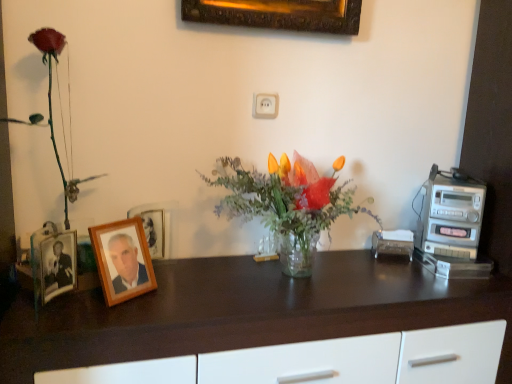
Locate an element on the screen. Image resolution: width=512 pixels, height=384 pixels. free location to the right of wooden picture frame at left, arranged as the first picture frame when viewed from the back is located at coordinates (185, 277).